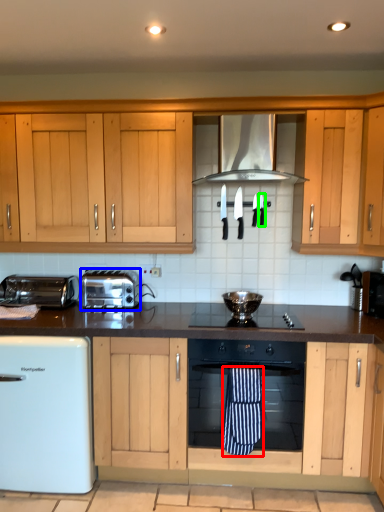
Question: Estimate the real-world distances between objects in this image. Which object is farther from beach towel (highlighted by a red box), toaster (highlighted by a blue box) or appliance (highlighted by a green box)?

Choices:
 (A) toaster
 (B) appliance

Answer: (B)